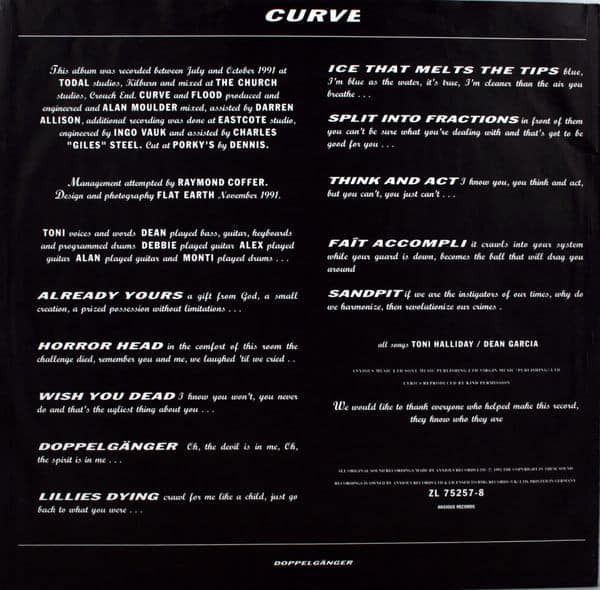
The image size is (600, 590). I want to click on column, so click(156, 228), click(431, 186).